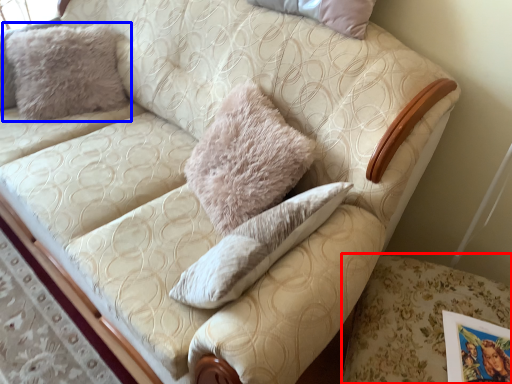
Question: Which object is closer to the camera taking this photo, swivel chair (highlighted by a red box) or pillow (highlighted by a blue box)?

Choices:
 (A) swivel chair
 (B) pillow

Answer: (A)